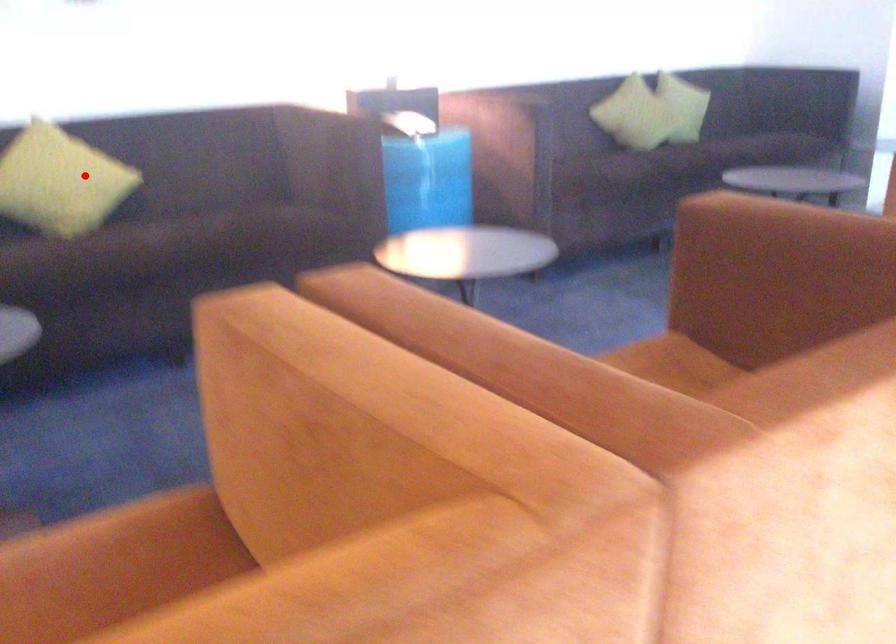
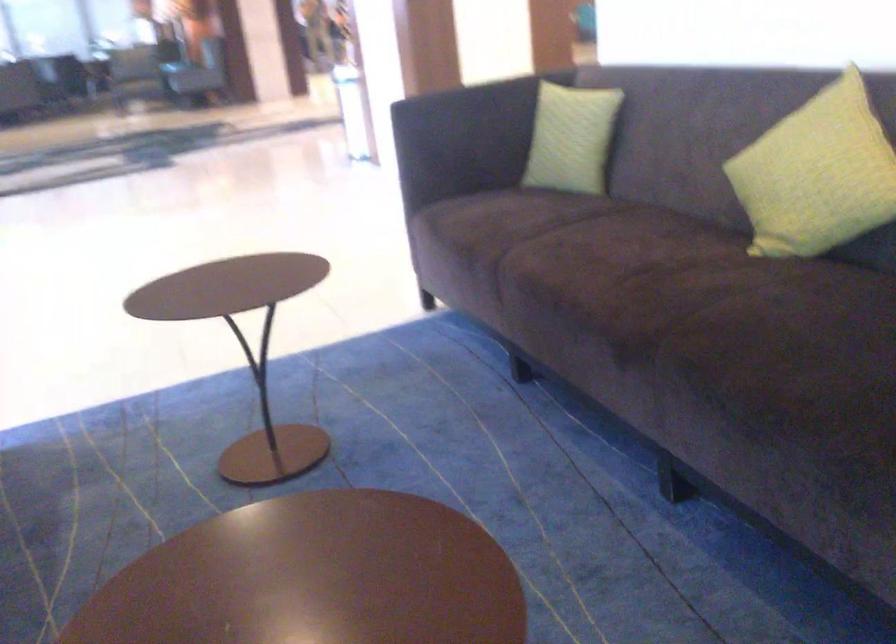
Question: I am providing you with two images of the same scene from different viewpoints. A red point is marked on the first image. At the location where the point appears in image 1, is it still visible in image 2?

Choices:
 (A) Yes
 (B) No

Answer: (A)